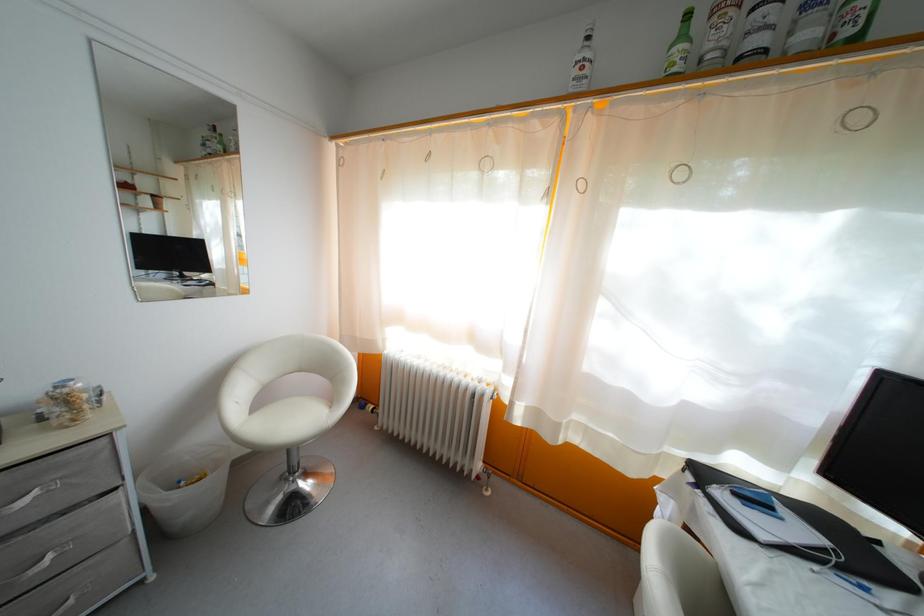
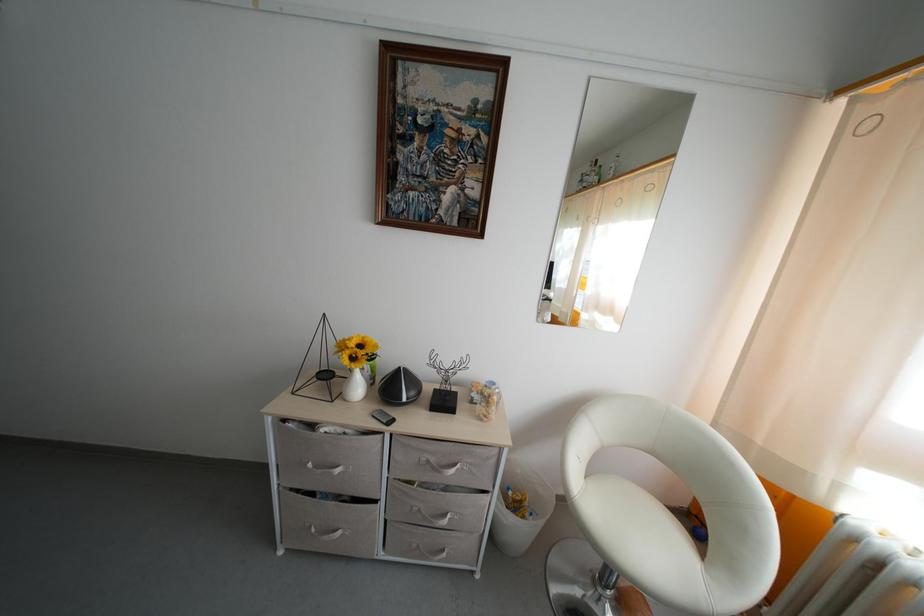
Question: The camera is either moving clockwise (left) or counter-clockwise (right) around the object. The first image is from the beginning of the video and the second image is from the end. Is the camera moving left or right when shooting the video?

Choices:
 (A) Left
 (B) Right

Answer: (B)